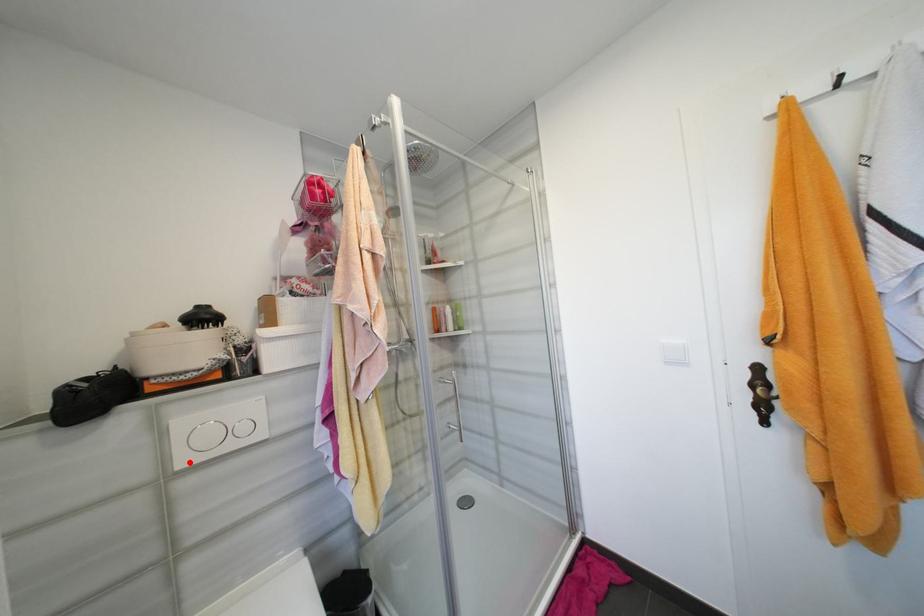
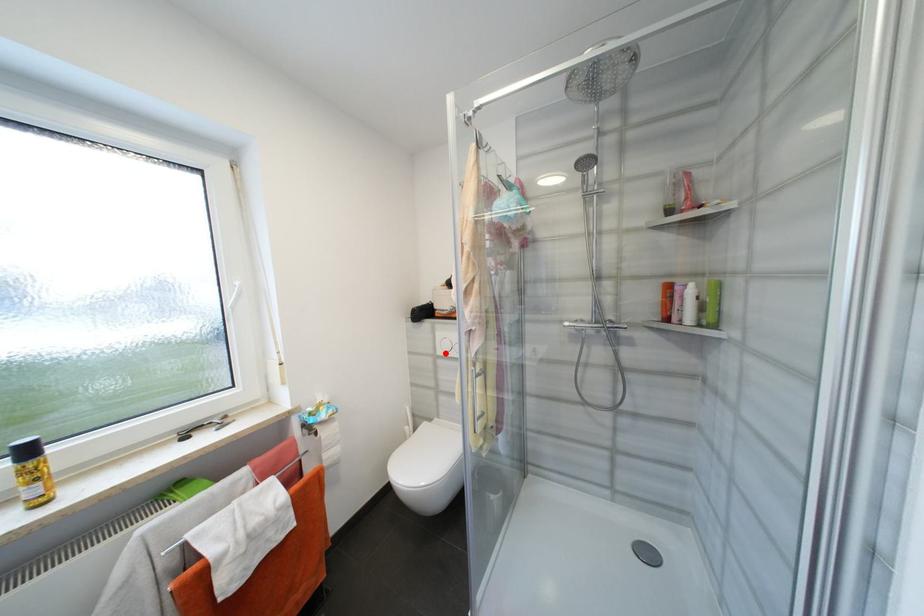
I am providing you with two images of the same scene from different viewpoints. A red point is marked on the first image and another point is marked on the second image. Are the points marked in image1 and image2 representing the same 3D position?

Yes